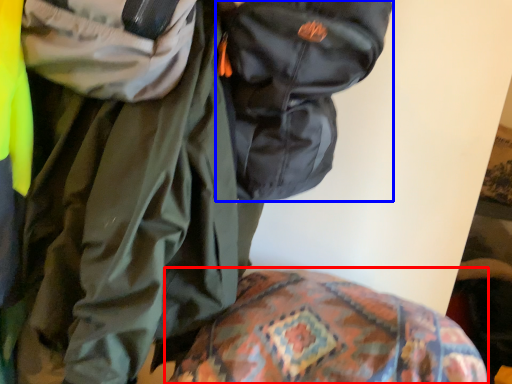
Question: Among these objects, which one is nearest to the camera, bedding (highlighted by a red box) or backpack (highlighted by a blue box)?

Choices:
 (A) bedding
 (B) backpack

Answer: (A)